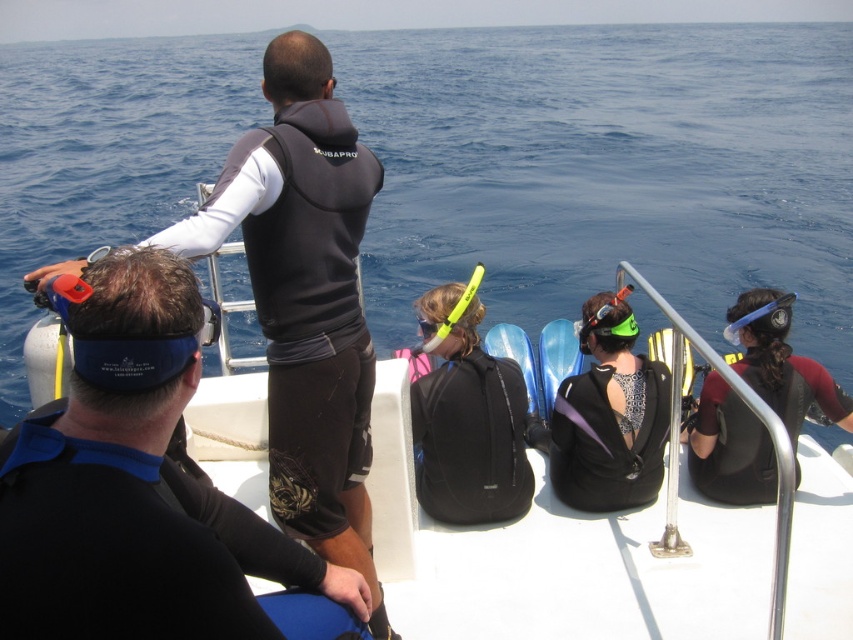
Is point (276, 106) less distant than point (727, 483)?

Yes, point (276, 106) is in front of point (727, 483).

This screenshot has height=640, width=853. What are the coordinates of `black matte wetsuit at upper center` in the screenshot? It's located at (305, 298).

Is black matte boat at center above black matte backpack at center?

Incorrect, black matte boat at center is not positioned above black matte backpack at center.

Where is `black matte boat at center`? black matte boat at center is located at coordinates pos(610,556).

In the scene shown: Measure the distance between point (247, 445) and camera.

4.06 meters

The height and width of the screenshot is (640, 853). What are the coordinates of `black matte boat at center` in the screenshot? It's located at (610, 556).

Between point (61, 122) and point (762, 326), which one is positioned in front?

Point (762, 326) is more forward.

Does blue water at upper center have a greater height compared to black matte wetsuit at right?

Indeed, blue water at upper center has a greater height compared to black matte wetsuit at right.

Who is more forward, (16, 234) or (728, 445)?

Point (728, 445) is more forward.

This screenshot has width=853, height=640. I want to click on blue water at upper center, so click(608, 168).